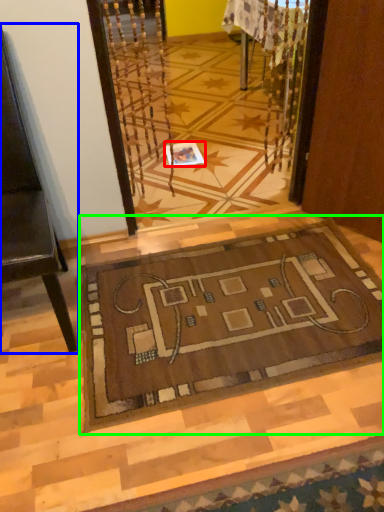
Question: Which object is positioned closest to square (highlighted by a red box)? Select from furniture (highlighted by a blue box) and mat (highlighted by a green box).

Choices:
 (A) furniture
 (B) mat

Answer: (B)